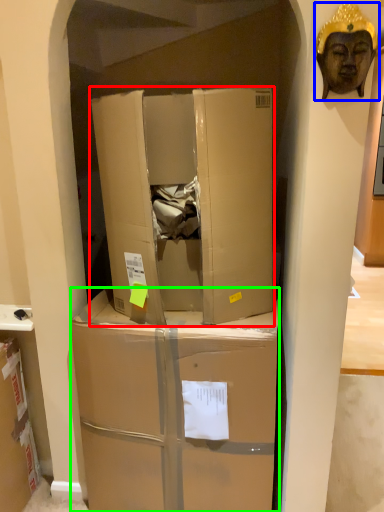
Question: Which object is positioned closest to box (highlighted by a red box)? Select from person (highlighted by a blue box) and box (highlighted by a green box).

Choices:
 (A) person
 (B) box

Answer: (B)